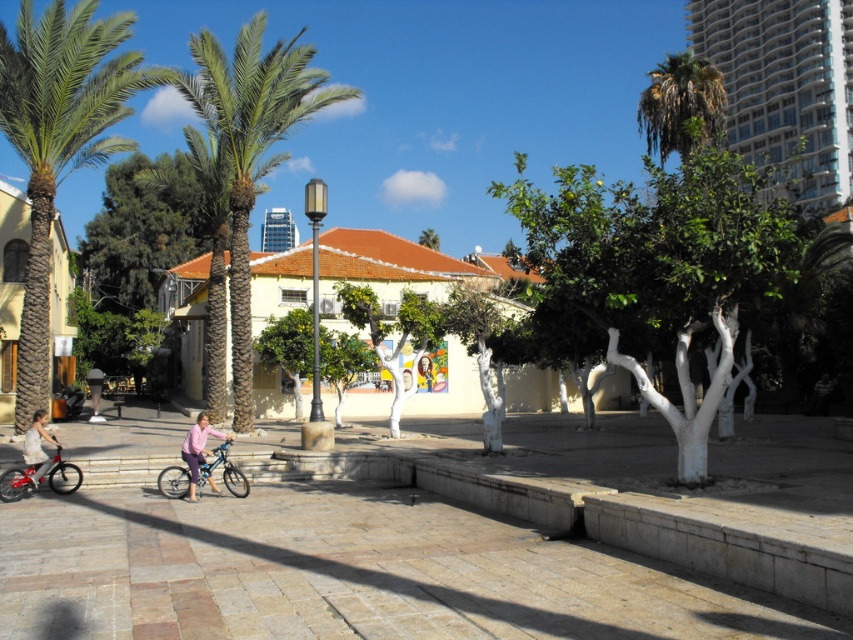
Between metallic silver bicycle at lower left and pink fabric shirt at center, which one is positioned higher?

metallic silver bicycle at lower left is higher up.

Does point (53, 483) come in front of point (228, 435)?

Yes, it is.

Locate an element on the screen. The width and height of the screenshot is (853, 640). metallic silver bicycle at lower left is located at coordinates (18, 481).

Between pink fabric shirt at center and light pink fabric dress at lower left, which one is positioned lower?

pink fabric shirt at center

Which is behind, point (201, 433) or point (33, 444)?

Positioned behind is point (33, 444).

The width and height of the screenshot is (853, 640). What are the coordinates of `pink fabric shirt at center` in the screenshot? It's located at (196, 449).

Which is behind, point (699, 438) or point (204, 465)?

The point (204, 465) is behind.

Is point (735, 269) behind point (224, 440)?

No.

Identify the location of green leafy tree at center. (660, 266).